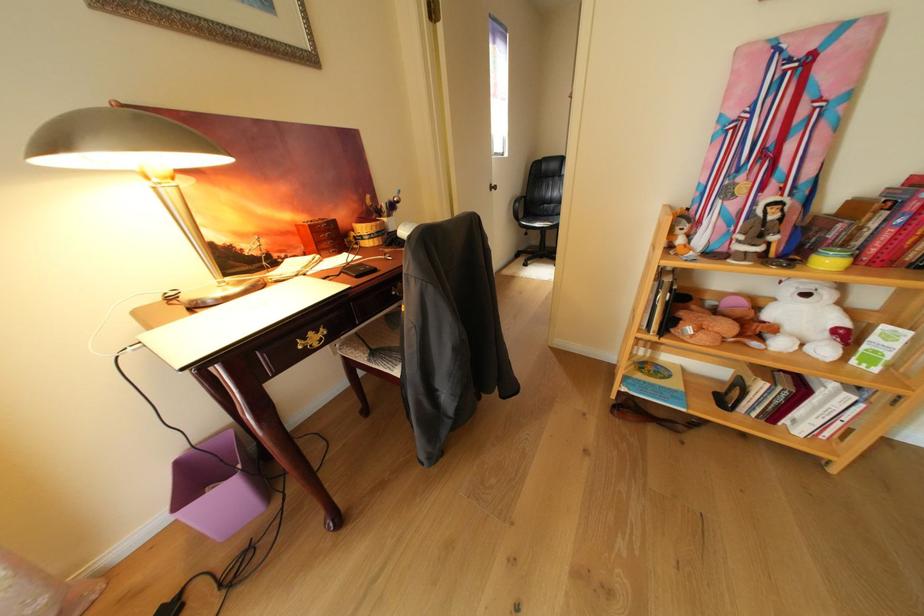
What do you see at coordinates (492, 187) in the screenshot? The width and height of the screenshot is (924, 616). I see `the silver doorknob` at bounding box center [492, 187].